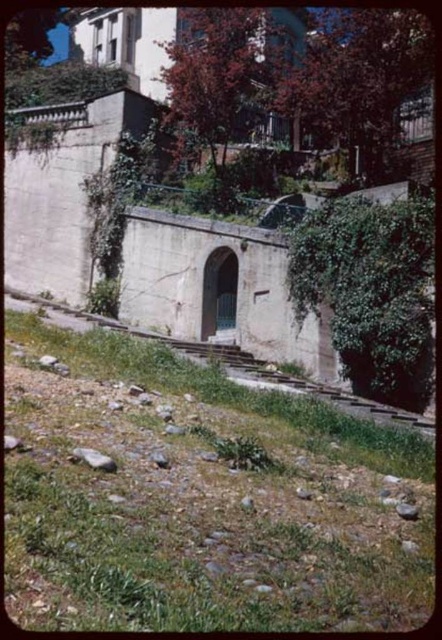
Question: Is green grass at lower left in front of smooth gray rock at lower right?

Choices:
 (A) no
 (B) yes

Answer: (B)

Question: Does green grass at lower left appear under smooth gray rock at lower right?

Choices:
 (A) yes
 (B) no

Answer: (B)

Question: Does green grass at lower left have a smaller size compared to smooth gray rock at lower right?

Choices:
 (A) no
 (B) yes

Answer: (A)

Question: Which of the following is the closest to the observer?

Choices:
 (A) green grass at lower left
 (B) smooth gray rock at lower right

Answer: (A)